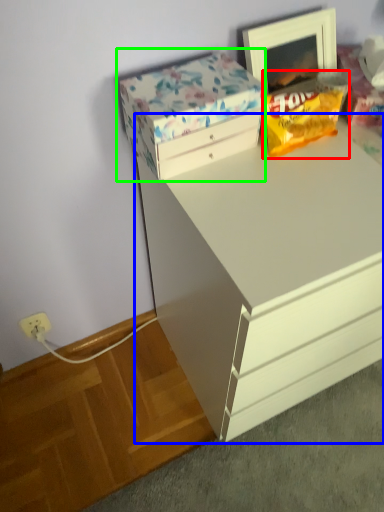
Question: Which object is the closest to the snack (highlighted by a red box)? Choose among these: chest of drawers (highlighted by a blue box) or storage box (highlighted by a green box).

Choices:
 (A) chest of drawers
 (B) storage box

Answer: (B)